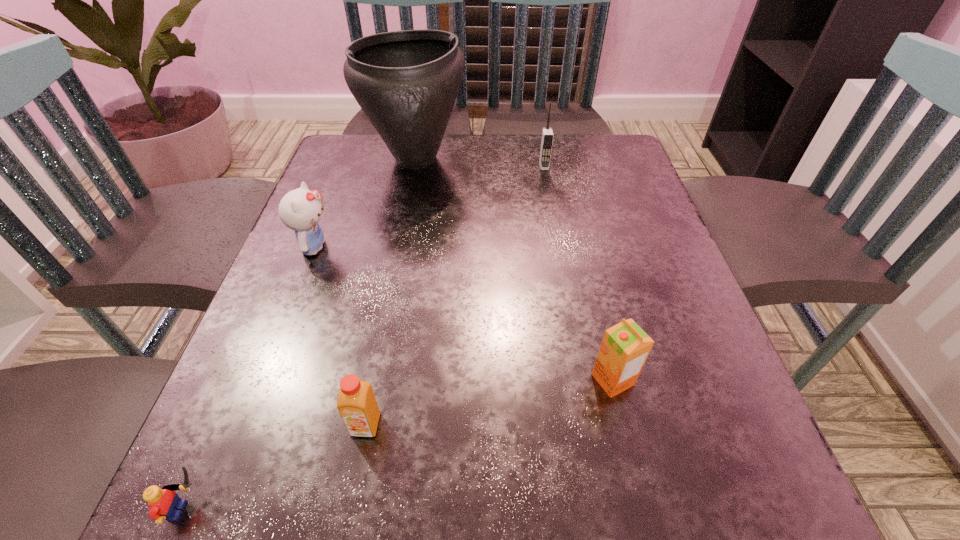
Identify the location of free space between the rightmost object and the cellular telephone. pyautogui.click(x=578, y=273).

Locate an element on the screen. Image resolution: width=960 pixels, height=540 pixels. free space between the urn and the cellular telephone is located at coordinates (480, 163).

At what (x,y) coordinates should I click in order to perform the action: click on vacant point located between the fifth farthest object and the urn. Please return your answer as a coordinate pair (x, y). Looking at the image, I should click on (391, 292).

Locate an element on the screen. The height and width of the screenshot is (540, 960). vacant area that lies between the cellular telephone and the fifth farthest object is located at coordinates (455, 295).

I want to click on vacant space that is in between the urn and the second nearest object, so (391, 292).

You are a GUI agent. You are given a task and a screenshot of the screen. Output one action in this format:
    pyautogui.click(x=<x>, y=<y>)
    Task: Click on the unoccupied position between the cellular telephone and the kitten
    This screenshot has width=960, height=540.
    Given the screenshot: What is the action you would take?
    pyautogui.click(x=429, y=207)

What are the coordinates of `empty space between the Lego and the farther orange juice` in the screenshot? It's located at (402, 445).

You are a GUI agent. You are given a task and a screenshot of the screen. Output one action in this format:
    pyautogui.click(x=<x>, y=<y>)
    Task: Click on the vacant area between the fourth nearest object and the second object from right to left
    
    Given the screenshot: What is the action you would take?
    [429, 207]

At what (x,y) coordinates should I click in order to perform the action: click on vacant space in between the third farthest object and the left orange juice. Please return your answer as a coordinate pair (x, y). The image size is (960, 540). Looking at the image, I should click on (340, 336).

The height and width of the screenshot is (540, 960). I want to click on vacant area between the left orange juice and the shortest object, so click(278, 468).